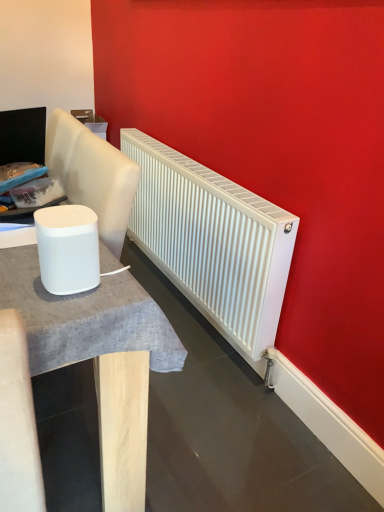
The height and width of the screenshot is (512, 384). What do you see at coordinates (68, 248) in the screenshot?
I see `white matte speaker at left` at bounding box center [68, 248].

Locate an element on the screen. This screenshot has height=512, width=384. white matte speaker at left is located at coordinates (68, 248).

Is white matte radiator at center looking in the opposite direction of white matte speaker at left?

No, white matte radiator at center is not facing the opposite direction of white matte speaker at left.

Considering the relative sizes of white matte radiator at center and white matte speaker at left in the image provided, is white matte radiator at center thinner than white matte speaker at left?

In fact, white matte radiator at center might be wider than white matte speaker at left.

From a real-world perspective, which is physically above, white matte radiator at center or white matte speaker at left?

In real-world perspective, white matte speaker at left is above.

Considering the points (59, 288) and (108, 438), which point is behind, point (59, 288) or point (108, 438)?

Positioned behind is point (108, 438).

Between white matte speaker at left and white matte table at left, which one has more height?

With more height is white matte table at left.

Can you confirm if white matte speaker at left is thinner than white matte table at left?

Correct, the width of white matte speaker at left is less than that of white matte table at left.

From a real-world perspective, which object rests below the other?

white matte table at left is physically lower.

Is point (100, 332) positioned behind point (36, 222)?

Yes.

Who is more distant, white matte table at left or white matte speaker at left?

white matte speaker at left is further from the camera.

Is white matte table at left at the right side of white matte speaker at left?

Incorrect, white matte table at left is not on the right side of white matte speaker at left.

Identify the location of table below the white matte speaker at left (from a real-world perspective). This screenshot has width=384, height=512. (99, 358).

From the image's perspective, which one is positioned higher, white matte table at left or white matte radiator at center?

white matte radiator at center.

How different are the orientations of white matte table at left and white matte radiator at center in degrees?

There is a 90-degree angle between the facing directions of white matte table at left and white matte radiator at center.

Is the surface of white matte table at left in direct contact with white matte radiator at center?

No, white matte table at left is not in contact with white matte radiator at center.

How different are the orientations of white matte radiator at center and white matte table at left in degrees?

The angle between the facing direction of white matte radiator at center and the facing direction of white matte table at left is 90 degrees.

Looking at this image, is white matte radiator at center at the right side of white matte table at left?

Indeed, white matte radiator at center is positioned on the right side of white matte table at left.

From a real-world perspective, is white matte radiator at center on top of white matte table at left?

Correct, in the physical world, white matte radiator at center is higher than white matte table at left.

Which object is further away from the camera, white matte radiator at center or white matte table at left?

white matte radiator at center is further from the camera.

From the image's perspective, is white matte speaker at left located above white matte radiator at center?

No.

Are white matte speaker at left and white matte radiator at center located far from each other?

No, white matte speaker at left is not far away from white matte radiator at center.

Image resolution: width=384 pixels, height=512 pixels. I want to click on appliance below the white matte radiator at center (from the image's perspective), so click(68, 248).

Where is `appliance behind the white matte table at left`? appliance behind the white matte table at left is located at coordinates (68, 248).

Which object lies further to the anchor point white matte table at left, white matte radiator at center or white matte speaker at left?

white matte radiator at center.

Based on their spatial positions, is white matte table at left or white matte speaker at left further from white matte radiator at center?

Among the two, white matte speaker at left is located further to white matte radiator at center.

Which object lies nearer to the anchor point white matte table at left, white matte speaker at left or white matte radiator at center?

white matte speaker at left is positioned closer to the anchor white matte table at left.

When comparing their distances from white matte radiator at center, does white matte speaker at left or white matte table at left seem further?

Among the two, white matte speaker at left is located further to white matte radiator at center.

Which object lies nearer to the anchor point white matte speaker at left, white matte table at left or white matte radiator at center?

white matte table at left.

Which object lies further to the anchor point white matte speaker at left, white matte radiator at center or white matte table at left?

The object further to white matte speaker at left is white matte radiator at center.

You are a GUI agent. You are given a task and a screenshot of the screen. Output one action in this format:
    pyautogui.click(x=<x>, y=<y>)
    Task: Click on the appliance located between white matte table at left and white matte radiator at center in the depth direction
    The width and height of the screenshot is (384, 512).
    Given the screenshot: What is the action you would take?
    pyautogui.click(x=68, y=248)